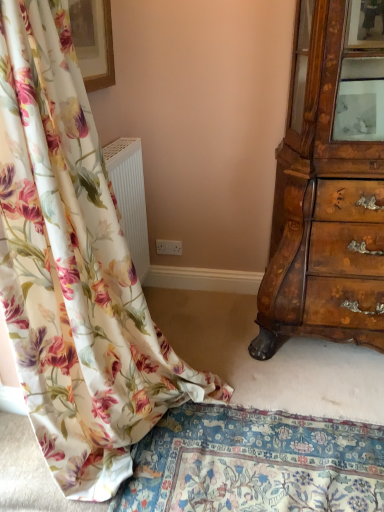
Question: Does wooden picture frame at upper left have a greater height compared to floral fabric curtain at left?

Choices:
 (A) yes
 (B) no

Answer: (B)

Question: Is wooden picture frame at upper left not near floral fabric curtain at left?

Choices:
 (A) no
 (B) yes

Answer: (A)

Question: From a real-world perspective, is wooden picture frame at upper left positioned over floral fabric curtain at left based on gravity?

Choices:
 (A) yes
 (B) no

Answer: (A)

Question: From a real-world perspective, is wooden picture frame at upper left beneath floral fabric curtain at left?

Choices:
 (A) no
 (B) yes

Answer: (A)

Question: Is wooden picture frame at upper left at the right side of floral fabric curtain at left?

Choices:
 (A) no
 (B) yes

Answer: (A)

Question: Would you say wooden picture frame at upper left is outside floral fabric curtain at left?

Choices:
 (A) yes
 (B) no

Answer: (A)

Question: From the image's perspective, is floral fabric curtain at left on top of wooden picture frame at upper left?

Choices:
 (A) yes
 (B) no

Answer: (B)

Question: Is floral fabric curtain at left far away from wooden picture frame at upper left?

Choices:
 (A) yes
 (B) no

Answer: (B)

Question: Can you confirm if floral fabric curtain at left is smaller than wooden picture frame at upper left?

Choices:
 (A) no
 (B) yes

Answer: (A)

Question: From a real-world perspective, is floral fabric curtain at left on top of wooden picture frame at upper left?

Choices:
 (A) yes
 (B) no

Answer: (B)

Question: Is floral fabric curtain at left looking in the opposite direction of wooden picture frame at upper left?

Choices:
 (A) yes
 (B) no

Answer: (B)

Question: Is floral fabric curtain at left to the left of wooden picture frame at upper left from the viewer's perspective?

Choices:
 (A) yes
 (B) no

Answer: (B)

Question: Is floral fabric curtain at left to the left or to the right of wooden picture frame at upper left in the image?

Choices:
 (A) left
 (B) right

Answer: (B)